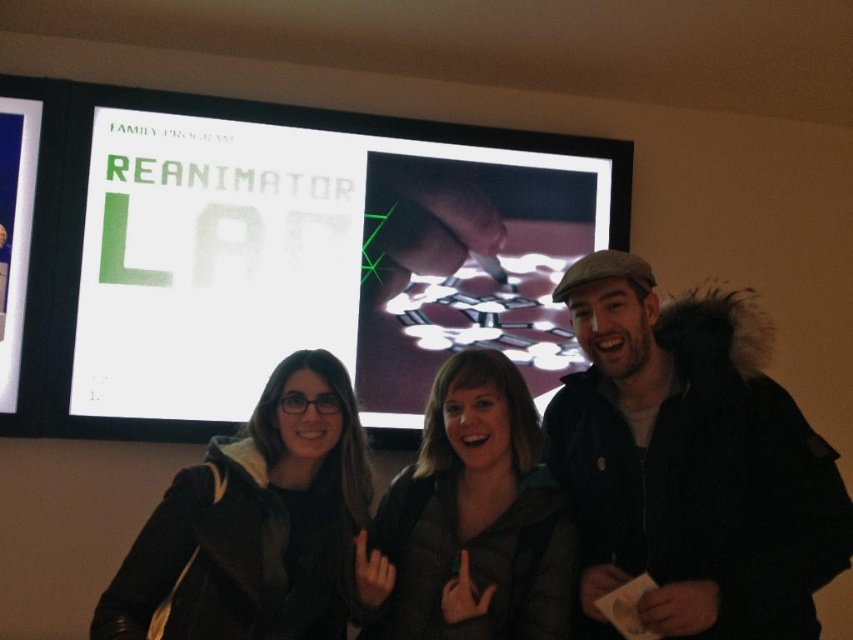
Between white glossy projection screen at upper center and black matte jacket at center, which one appears on the left side from the viewer's perspective?

black matte jacket at center

Who is more distant from viewer, (x=585, y=189) or (x=289, y=627)?

The point (x=585, y=189) is more distant.

Is point (209, 307) positioned in front of point (137, 624)?

No.

Locate an element on the screen. The image size is (853, 640). white glossy projection screen at upper center is located at coordinates (315, 253).

Is black matte jacket at center to the left of dark brown leather jacket at center from the viewer's perspective?

Correct, you'll find black matte jacket at center to the left of dark brown leather jacket at center.

Can you confirm if black matte jacket at center is smaller than dark brown leather jacket at center?

Incorrect, black matte jacket at center is not smaller in size than dark brown leather jacket at center.

Where is `black matte jacket at center`? This screenshot has height=640, width=853. black matte jacket at center is located at coordinates (260, 525).

Locate an element on the screen. Image resolution: width=853 pixels, height=640 pixels. black matte jacket at center is located at coordinates (260, 525).

Between point (525, 237) and point (428, 532), which one is positioned behind?

The point (525, 237) is behind.

Is white glossy projection screen at upper center bigger than dark brown leather jacket at center?

Yes, white glossy projection screen at upper center is bigger than dark brown leather jacket at center.

Is point (317, 216) farther from camera compared to point (476, 374)?

Yes, it is.

This screenshot has height=640, width=853. I want to click on white glossy projection screen at upper center, so click(315, 253).